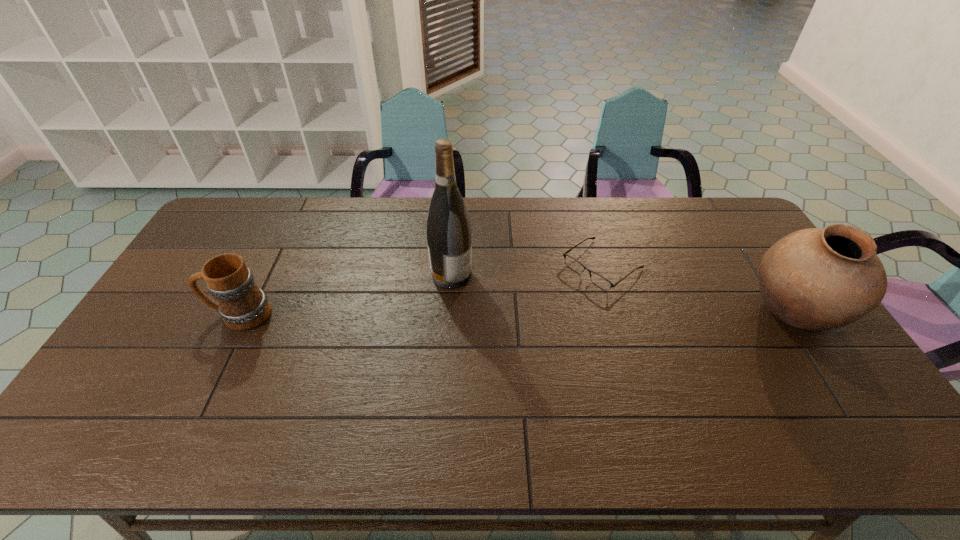
The image size is (960, 540). In the image, there is a desktop. Find the location of `free space at the far edge`. free space at the far edge is located at coordinates (568, 230).

Identify the location of free location at the near edge. (444, 398).

Identify the location of blank area at the left edge. The width and height of the screenshot is (960, 540). (181, 276).

Find the location of a particular element. This screenshot has height=540, width=960. blank space at the far left corner of the desktop is located at coordinates (229, 200).

This screenshot has height=540, width=960. I want to click on free space at the near left corner of the desktop, so click(156, 380).

At what (x,y) coordinates should I click in order to perform the action: click on free space at the far right corner. Please return your answer as a coordinate pair (x, y). This screenshot has height=540, width=960. Looking at the image, I should click on (736, 233).

The width and height of the screenshot is (960, 540). I want to click on free area in between the tallest object and the third tallest object, so (x=346, y=295).

Find the location of `free spot between the mug and the third object from left to right`. free spot between the mug and the third object from left to right is located at coordinates tap(421, 290).

The height and width of the screenshot is (540, 960). I want to click on vacant area that lies between the pottery and the spectacles, so click(697, 289).

Identify the location of vacant area between the second tallest object and the tallest object. The image size is (960, 540). (622, 294).